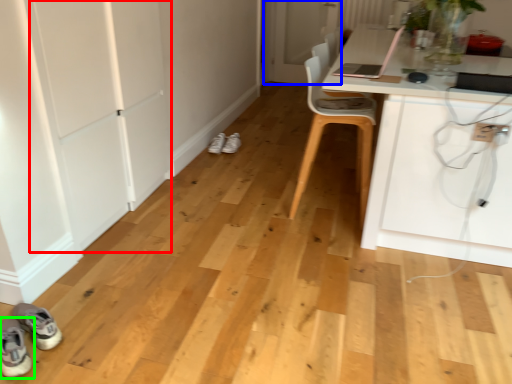
Question: Which is nearer to the door (highlighted by a red box)? door (highlighted by a blue box) or footwear (highlighted by a green box).

Choices:
 (A) door
 (B) footwear

Answer: (B)